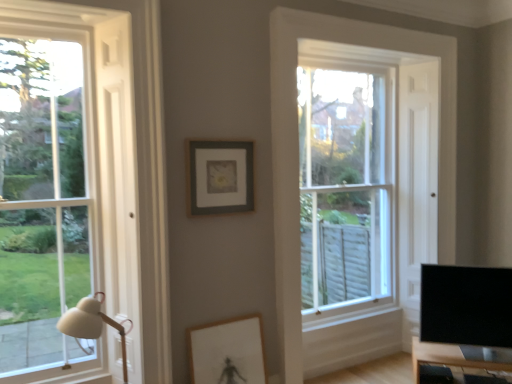
Question: Could you tell me if matte wooden picture frame at center, arranged as the 1th picture frame when ordered from the bottom, is facing wooden table at lower right?

Choices:
 (A) no
 (B) yes

Answer: (A)

Question: Can we say matte wooden picture frame at center, arranged as the 1th picture frame when ordered from the bottom, lies outside wooden table at lower right?

Choices:
 (A) yes
 (B) no

Answer: (A)

Question: Is matte wooden picture frame at center, acting as the 2th picture frame starting from the top, far away from wooden table at lower right?

Choices:
 (A) no
 (B) yes

Answer: (B)

Question: Is the position of matte wooden picture frame at center, acting as the 2th picture frame starting from the top, more distant than that of wooden table at lower right?

Choices:
 (A) no
 (B) yes

Answer: (A)

Question: From a real-world perspective, does matte wooden picture frame at center, arranged as the 1th picture frame when ordered from the bottom, stand above wooden table at lower right?

Choices:
 (A) yes
 (B) no

Answer: (A)

Question: In the image, is black glossy tv at lower right on the left side or the right side of clear glass window at left, the 1th window from the front?

Choices:
 (A) left
 (B) right

Answer: (B)

Question: Considering the positions of black glossy tv at lower right and clear glass window at left, positioned as the first window in left-to-right order, in the image, is black glossy tv at lower right wider or thinner than clear glass window at left, positioned as the first window in left-to-right order,?

Choices:
 (A) wide
 (B) thin

Answer: (A)

Question: Considering their positions, is black glossy tv at lower right located in front of or behind clear glass window at left, the second window positioned from the right?

Choices:
 (A) front
 (B) behind

Answer: (B)

Question: From the image's perspective, relative to clear glass window at left, positioned as the first window in left-to-right order, is black glossy tv at lower right above or below?

Choices:
 (A) above
 (B) below

Answer: (B)

Question: In the image, is matte wooden picture frame at center, arranged as the 1th picture frame when ordered from the bottom, positioned in front of or behind black glossy tv at lower right?

Choices:
 (A) front
 (B) behind

Answer: (A)

Question: Looking at their shapes, would you say matte wooden picture frame at center, acting as the 2th picture frame starting from the top, is wider or thinner than black glossy tv at lower right?

Choices:
 (A) thin
 (B) wide

Answer: (A)

Question: Looking at the image, does matte wooden picture frame at center, acting as the 2th picture frame starting from the top, seem bigger or smaller compared to black glossy tv at lower right?

Choices:
 (A) small
 (B) big

Answer: (A)

Question: From the image's perspective, is matte wooden picture frame at center, arranged as the 1th picture frame when ordered from the bottom, positioned above or below black glossy tv at lower right?

Choices:
 (A) above
 (B) below

Answer: (B)

Question: Considering the positions of point click(89, 329) and point click(352, 294), is point click(89, 329) closer or farther from the camera than point click(352, 294)?

Choices:
 (A) closer
 (B) farther

Answer: (A)

Question: Choose the correct answer: Is white matte table lamp at left inside clear glass window at center, the 2th window from the left, or outside it?

Choices:
 (A) inside
 (B) outside

Answer: (B)